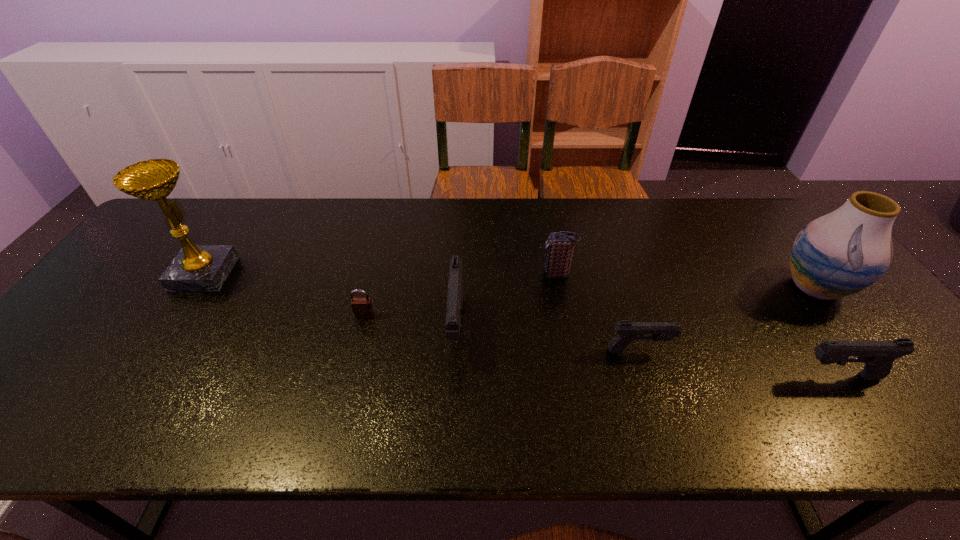
Locate an element on the screen. The image size is (960, 540). the tallest pistol is located at coordinates (455, 286).

Image resolution: width=960 pixels, height=540 pixels. Find the location of `the leftmost pistol`. the leftmost pistol is located at coordinates (455, 286).

The width and height of the screenshot is (960, 540). What are the coordinates of `the fifth object from left to right` in the screenshot? It's located at (627, 331).

Identify the location of the shortest pistol. (627, 331).

Identify the location of the rightmost pistol. Image resolution: width=960 pixels, height=540 pixels. (878, 355).

Identify the location of the second tallest pistol. The width and height of the screenshot is (960, 540). (878, 355).

Find the location of a particular element. This screenshot has width=960, height=540. the second tallest object is located at coordinates (839, 254).

This screenshot has width=960, height=540. I want to click on the fourth object from right to left, so click(559, 250).

Identify the location of award. The image size is (960, 540). (196, 268).

The height and width of the screenshot is (540, 960). I want to click on padlock, so click(362, 308).